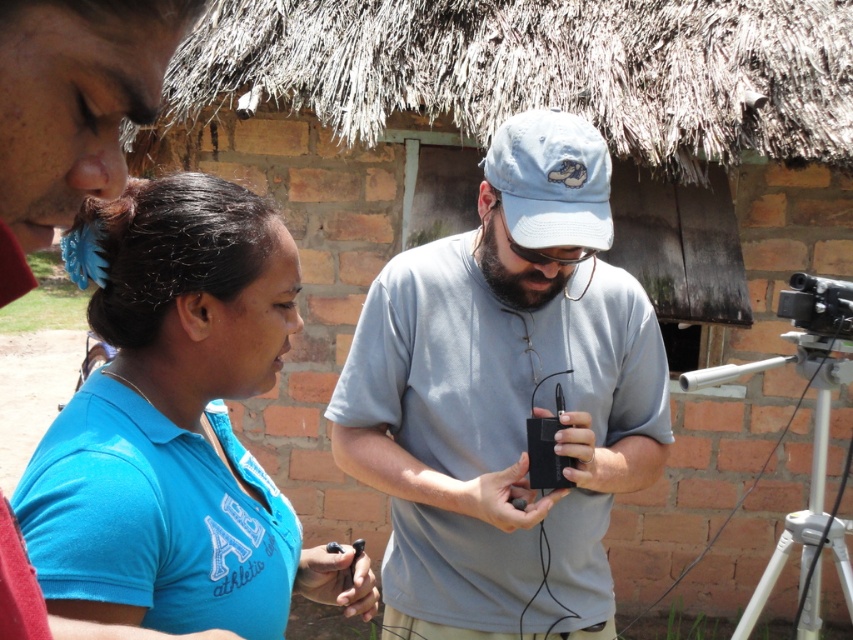
You are a photographer trying to set up a tripod in this scene. The scene has a white plastic tripod at lower right located at point [811,461]. Is there enough space between the tripod and the brick wall in the background to place a camera?

The white plastic tripod at lower right is positioned at point [811,461]. Since the brick wall is in the background, there should be sufficient space between them to place a camera.

You are a photographer setting up equipment for an outdoor event. You have a white plastic tripod at lower right and a black plastic video camera at right. Which object is closer to you, the photographer, when facing the scene?

The white plastic tripod at lower right is closer to you because it is positioned in front of the black plastic video camera at right.

You are a photographer setting up a tripod for a group photo. You see the light blue fabric baseball cap at center and the white plastic tripod at lower right. Which object is shorter?

The light blue fabric baseball cap at center is shorter than the white plastic tripod at lower right according to the description.